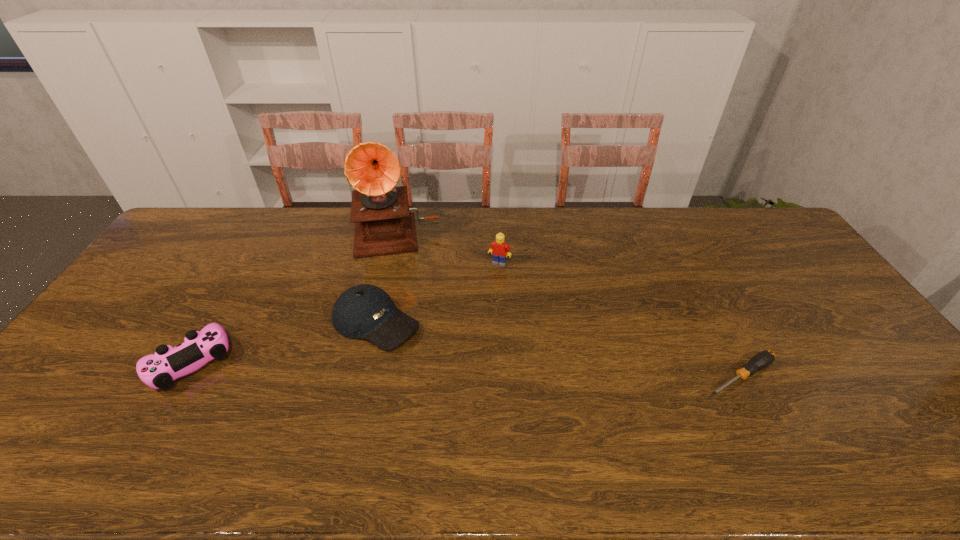
The width and height of the screenshot is (960, 540). Identify the location of free space on the desktop that is between the control and the screwdriver and is positioned on the front-facing side of the second object from right to left. (454, 369).

The height and width of the screenshot is (540, 960). Identify the location of free space on the desktop that is between the control and the screwdriver and is positioned on the horn of the farthest object. (402, 367).

I want to click on vacant space on the desktop that is between the leftmost object and the screwdriver and is positioned on the front-facing side of the baseball cap, so click(x=453, y=369).